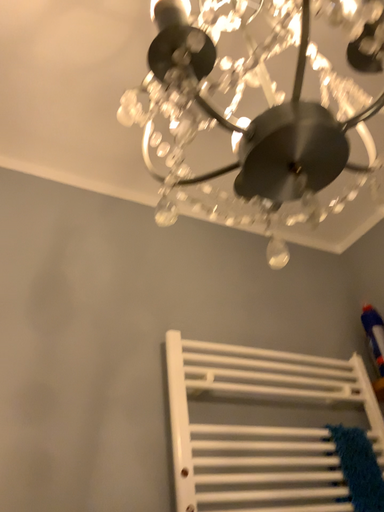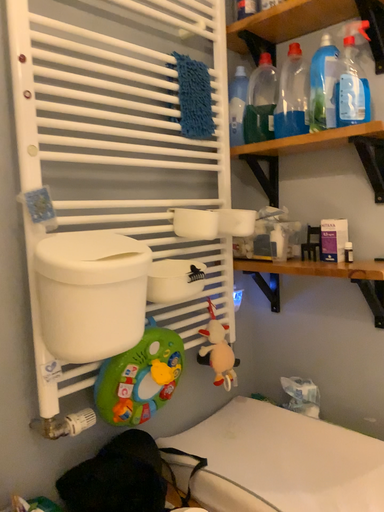
Question: How did the camera likely rotate when shooting the video?

Choices:
 (A) rotated right
 (B) rotated left

Answer: (A)